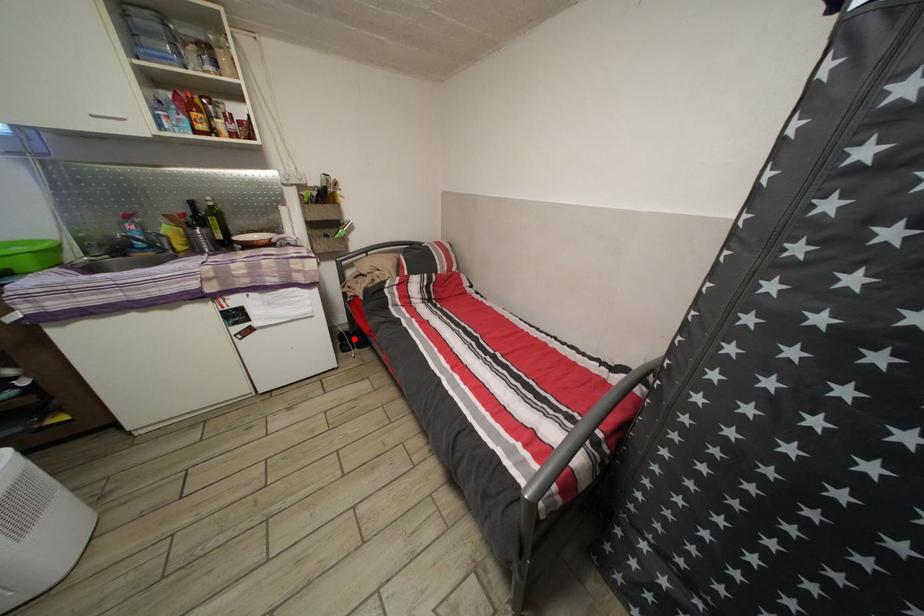
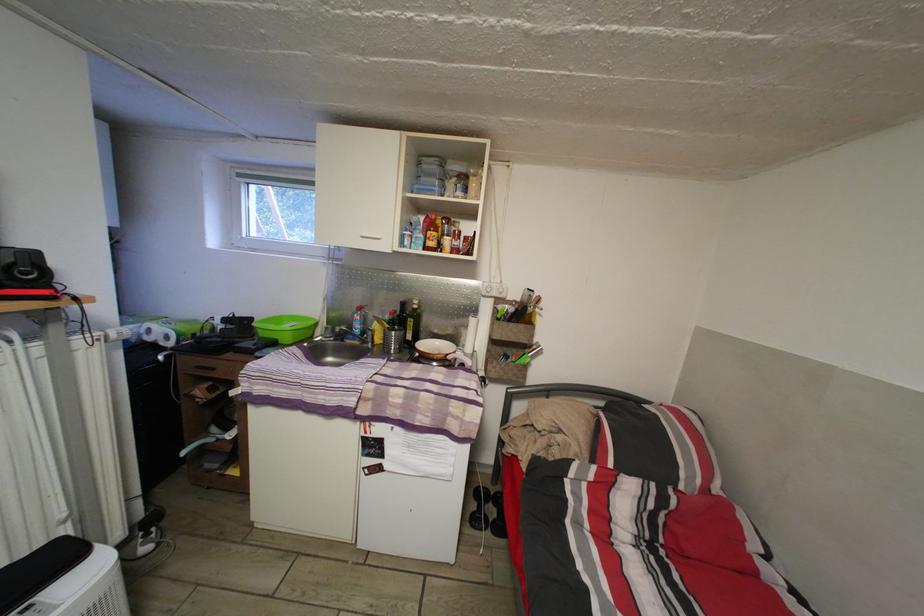
In the second image, find the point that corresponds to the highlighted location in the first image.

(493, 498)